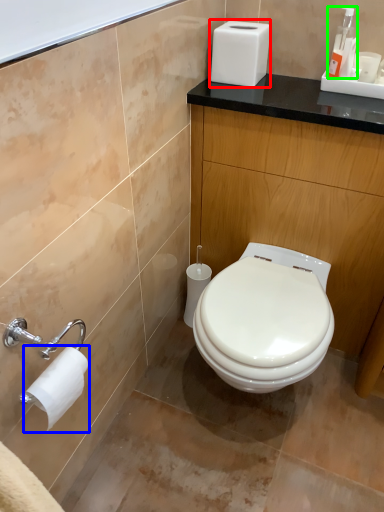
Question: Which object is positioned closest to appliance (highlighted by a red box)? Select from toilet paper (highlighted by a blue box) and soap dispenser (highlighted by a green box).

Choices:
 (A) toilet paper
 (B) soap dispenser

Answer: (B)